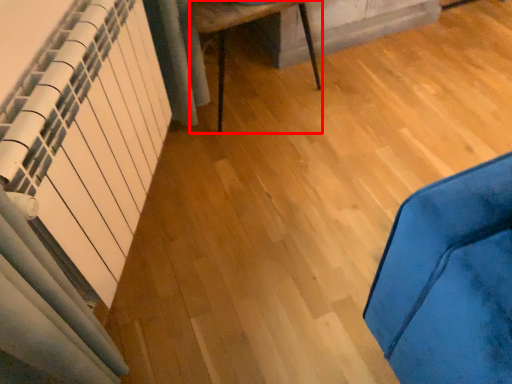
Question: Where is furniture (annotated by the red box) located in relation to radiator in the image?

Choices:
 (A) right
 (B) left

Answer: (A)